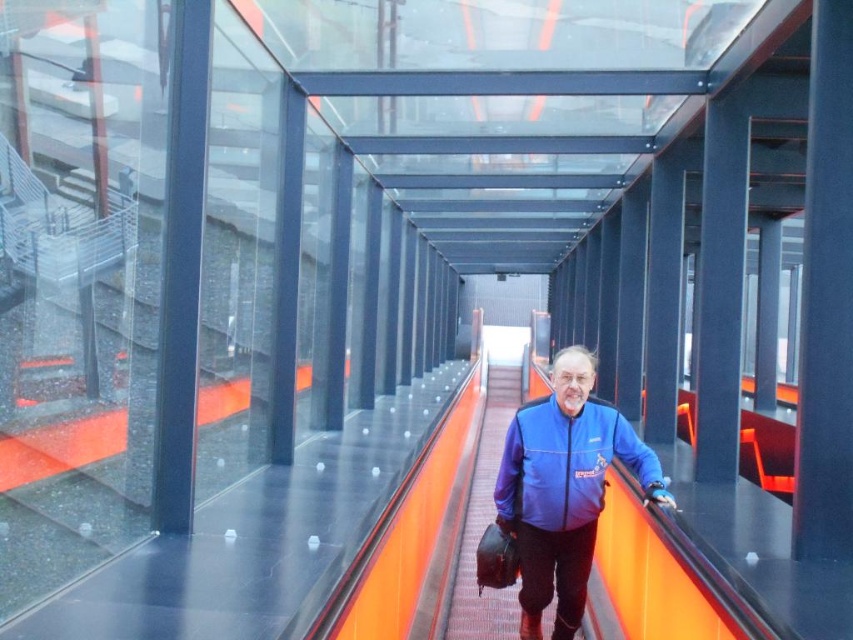
Question: Is blue fabric jacket at center wider than blue fleece jacket at center?

Choices:
 (A) no
 (B) yes

Answer: (B)

Question: Does blue fabric jacket at center have a lesser width compared to blue fleece jacket at center?

Choices:
 (A) yes
 (B) no

Answer: (B)

Question: Which object appears closest to the camera in this image?

Choices:
 (A) blue fabric jacket at center
 (B) blue fleece jacket at center

Answer: (A)

Question: Which point is farther to the camera?

Choices:
 (A) blue fleece jacket at center
 (B) blue fabric jacket at center

Answer: (A)

Question: Is blue fabric jacket at center bigger than blue fleece jacket at center?

Choices:
 (A) no
 (B) yes

Answer: (B)

Question: Which point appears farthest from the camera in this image?

Choices:
 (A) (518, 504)
 (B) (550, 436)

Answer: (A)